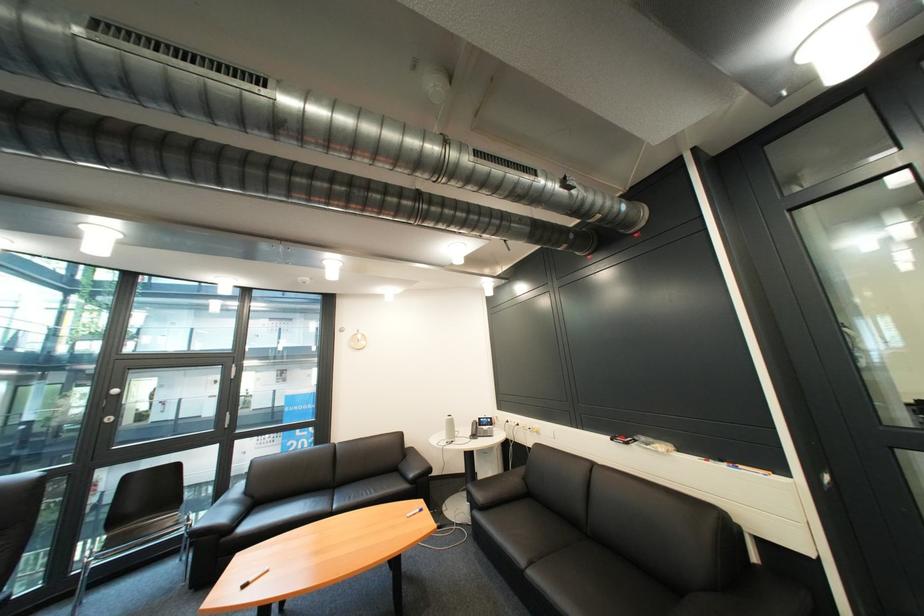
The location [448,429] corresponds to which object?

It refers to a white water bottle.